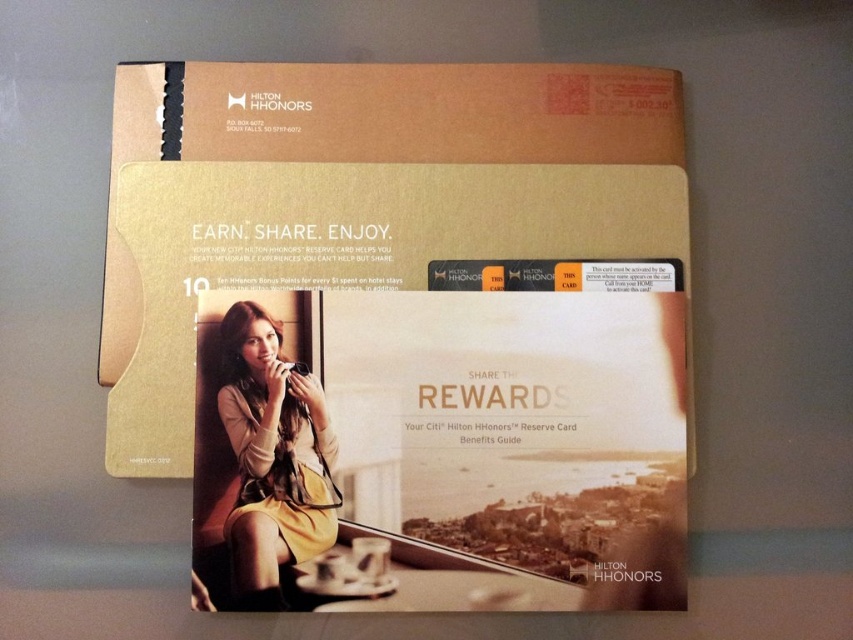
You are packing a suitcase and have a gold cardboard box at center and a yellow fabric dress at center. If you want to place both items in your suitcase, which item should you place first to maximize space efficiency?

You should place the gold cardboard box at center first because it is wider than the yellow fabric dress at center, allowing you to use the space more efficiently by placing the larger item first.

You are organizing a closet and see the gold cardboard box at center and the yellow fabric dress at center. Which item is located to the right of the other?

The gold cardboard box at center is positioned on the right side of the yellow fabric dress at center.

You are organizing a closet and see the gold cardboard box at center and the yellow fabric dress at center. Which item is positioned higher?

The gold cardboard box at center is located above the yellow fabric dress at center, so it is positioned higher.